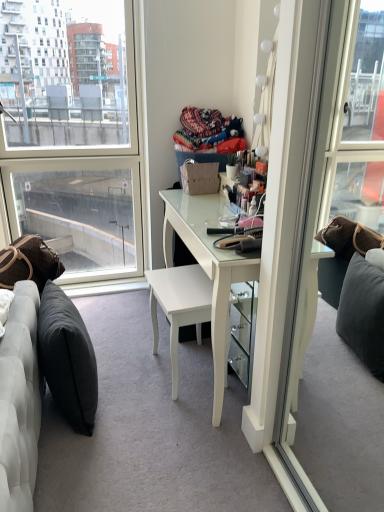
The image size is (384, 512). What are the coordinates of `free spot above white glossy desk at center (from a real-world perspective)` in the screenshot? It's located at (206, 218).